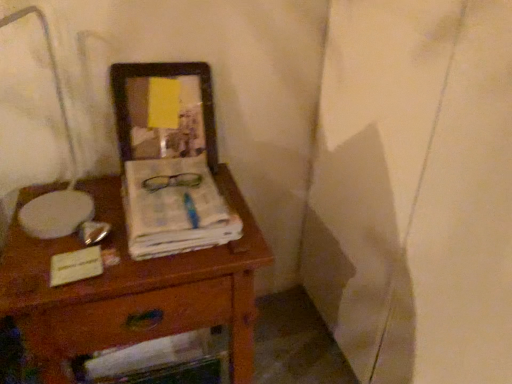
Identify the location of wooden desk at center. The image size is (512, 384). (132, 288).

Image resolution: width=512 pixels, height=384 pixels. What do you see at coordinates (175, 208) in the screenshot?
I see `white paper at center` at bounding box center [175, 208].

Looking at this image, in order to face wooden drawer at lower center, should I rotate leftwards or rightwards?

To align with it, rotate left about 12.413°.

Where is `wooden desk at center`? The image size is (512, 384). wooden desk at center is located at coordinates (132, 288).

Consider the image. From their relative heights in the image, would you say white paper at center is taller or shorter than wooden drawer at lower center?

white paper at center is shorter than wooden drawer at lower center.

Is white paper at center in contact with wooden drawer at lower center?

white paper at center and wooden drawer at lower center are clearly separated.

Considering the points (218, 197) and (50, 334), which point is behind, point (218, 197) or point (50, 334)?

Positioned behind is point (218, 197).

Can you see wooden picture frame at upper center touching white paper at center?

wooden picture frame at upper center is not next to white paper at center, and they're not touching.

Can you tell me how much wooden picture frame at upper center and white paper at center differ in facing direction?

There is a 0.00234-degree angle between the facing directions of wooden picture frame at upper center and white paper at center.

From the image's perspective, is wooden picture frame at upper center on top of white paper at center?

Yes, from the image's perspective, wooden picture frame at upper center is over white paper at center.

Which of these two, wooden drawer at lower center or white paper at center, is thinner?

Thinner between the two is wooden drawer at lower center.

Between wooden drawer at lower center and white paper at center, which one has larger size?

With larger size is wooden drawer at lower center.

Is wooden drawer at lower center with white paper at center?

No, wooden drawer at lower center is not making contact with white paper at center.

Based on the photo, is wooden desk at center oriented towards wooden picture frame at upper center?

No, wooden desk at center is not aimed at wooden picture frame at upper center.

What's the angular difference between wooden desk at center and wooden picture frame at upper center's facing directions?

There is a 0.134-degree angle between the facing directions of wooden desk at center and wooden picture frame at upper center.

Is wooden desk at center bigger or smaller than wooden picture frame at upper center?

In the image, wooden desk at center appears to be larger than wooden picture frame at upper center.

Measure the distance from wooden desk at center to wooden picture frame at upper center.

They are 12.42 inches apart.

Which is in front, wooden desk at center or white paper at center?

wooden desk at center.

In the scene shown: Which object is positioned more to the left, wooden desk at center or white paper at center?

Positioned to the left is wooden desk at center.

Can you confirm if wooden desk at center is taller than white paper at center?

Correct, wooden desk at center is much taller as white paper at center.

From a real-world perspective, between wooden desk at center and white paper at center, who is vertically higher?

white paper at center is physically above.

Is point (147, 167) positioned behind point (110, 71)?

No, it is in front of (110, 71).

Is wooden picture frame at upper center surrounded by white paper at center?

No, wooden picture frame at upper center is not a part of white paper at center.

Based on the photo, from a real-world perspective, is white paper at center above or below wooden picture frame at upper center?

In terms of real-world spatial position, white paper at center is below wooden picture frame at upper center.

Measure the distance from white paper at center to wooden picture frame at upper center.

white paper at center is 8.02 inches away from wooden picture frame at upper center.

Is wooden picture frame at upper center placed right next to wooden drawer at lower center?

There is a gap between wooden picture frame at upper center and wooden drawer at lower center.

From the image's perspective, which is above, wooden picture frame at upper center or wooden drawer at lower center?

wooden picture frame at upper center appears higher in the image.

Considering the sizes of objects wooden picture frame at upper center and wooden drawer at lower center in the image provided, who is taller, wooden picture frame at upper center or wooden drawer at lower center?

With more height is wooden picture frame at upper center.

In the image, there is a white paper at center. Identify the location of drawer below it (from a real-world perspective). (138, 317).

Locate an element on the screen. This screenshot has height=384, width=512. magazine to the right of wooden picture frame at upper center is located at coordinates (175, 208).

Which object lies nearer to the anchor point wooden desk at center, wooden drawer at lower center or wooden picture frame at upper center?

wooden drawer at lower center.

Which object lies nearer to the anchor point wooden desk at center, wooden picture frame at upper center or wooden drawer at lower center?

wooden drawer at lower center lies closer to wooden desk at center than the other object.

Looking at the image, which one is located closer to wooden drawer at lower center, wooden desk at center or wooden picture frame at upper center?

Among the two, wooden desk at center is located nearer to wooden drawer at lower center.

From the image, which object appears to be farther from wooden drawer at lower center, white paper at center or wooden picture frame at upper center?

Based on the image, wooden picture frame at upper center appears to be further to wooden drawer at lower center.

Looking at this image, when comparing their distances from wooden picture frame at upper center, does wooden desk at center or white paper at center seem closer?

white paper at center is closer to wooden picture frame at upper center.

From the image, which object appears to be nearer to wooden picture frame at upper center, wooden drawer at lower center or wooden desk at center?

Based on the image, wooden desk at center appears to be nearer to wooden picture frame at upper center.

Considering their positions, is white paper at center positioned further to wooden picture frame at upper center than wooden desk at center?

Among the two, wooden desk at center is located further to wooden picture frame at upper center.

Based on their spatial positions, is wooden picture frame at upper center or white paper at center closer to wooden drawer at lower center?

The object closer to wooden drawer at lower center is white paper at center.

The width and height of the screenshot is (512, 384). What are the coordinates of `magazine between wooden picture frame at upper center and wooden desk at center from top to bottom` in the screenshot? It's located at (175, 208).

This screenshot has width=512, height=384. I want to click on desk between wooden picture frame at upper center and wooden drawer at lower center from top to bottom, so click(x=132, y=288).

Where is `desk between white paper at center and wooden drawer at lower center from top to bottom`? desk between white paper at center and wooden drawer at lower center from top to bottom is located at coordinates (132, 288).

Find the location of a particular element. This screenshot has height=384, width=512. magazine between wooden picture frame at upper center and wooden drawer at lower center in the up-down direction is located at coordinates (175, 208).